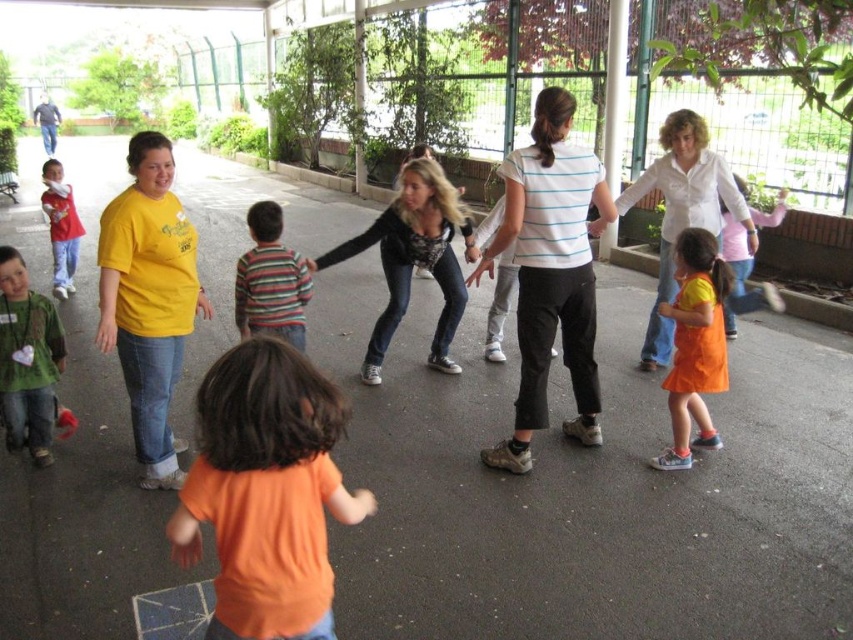
Between striped cotton shirt at center and matte red shirt at left, which one has less height?

striped cotton shirt at center is shorter.

Does striped cotton shirt at center have a greater height compared to matte red shirt at left?

Incorrect, striped cotton shirt at center's height is not larger of matte red shirt at left's.

Does point (244, 300) come closer to viewer compared to point (61, 232)?

That is True.

At what (x,y) coordinates should I click in order to perform the action: click on striped cotton shirt at center. Please return your answer as a coordinate pair (x, y). The image size is (853, 640). Looking at the image, I should click on (270, 280).

Where is `leather jacket at center`? leather jacket at center is located at coordinates (415, 259).

Between leather jacket at center and orange fabric dress at lower right, which one appears on the left side from the viewer's perspective?

leather jacket at center

Locate an element on the screen. leather jacket at center is located at coordinates (415, 259).

Identify the location of leather jacket at center. Image resolution: width=853 pixels, height=640 pixels. (415, 259).

Is orange matte shirt at center bigger than white shirt at center?

Actually, orange matte shirt at center might be smaller than white shirt at center.

Which is in front, point (293, 524) or point (653, 305)?

Point (293, 524) is more forward.

Find the location of `orange matte shirt at center`. orange matte shirt at center is located at coordinates point(265,492).